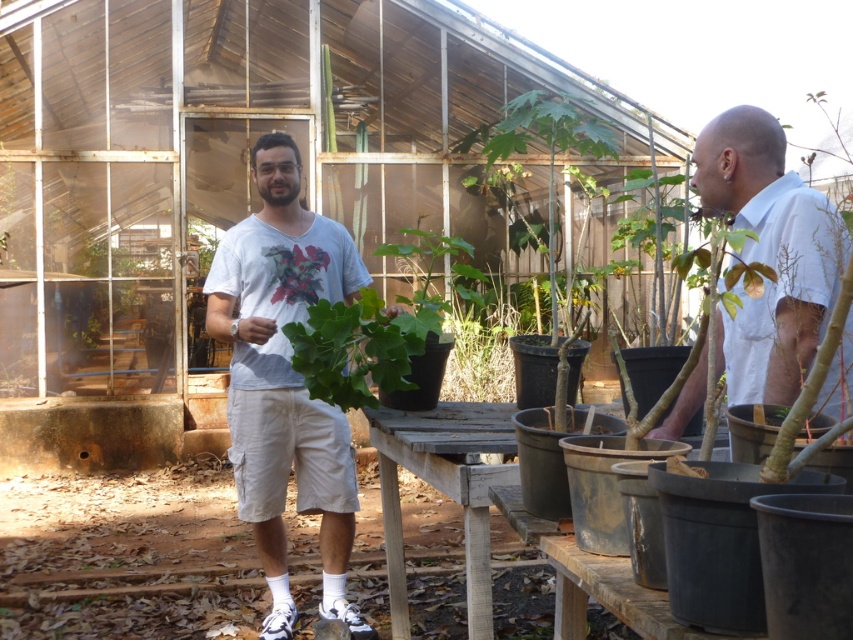
Question: Can you confirm if white cotton t-shirt at center is positioned above white matte shirt at right?

Choices:
 (A) yes
 (B) no

Answer: (B)

Question: Which point appears farthest from the camera in this image?

Choices:
 (A) (733, 212)
 (B) (305, 483)

Answer: (B)

Question: Which of the following is the farthest from the observer?

Choices:
 (A) white cotton t-shirt at center
 (B) white matte shirt at right

Answer: (A)

Question: From the image, what is the correct spatial relationship of white cotton t-shirt at center in relation to white matte shirt at right?

Choices:
 (A) above
 (B) below

Answer: (B)

Question: Is white cotton t-shirt at center bigger than white matte shirt at right?

Choices:
 (A) yes
 (B) no

Answer: (A)